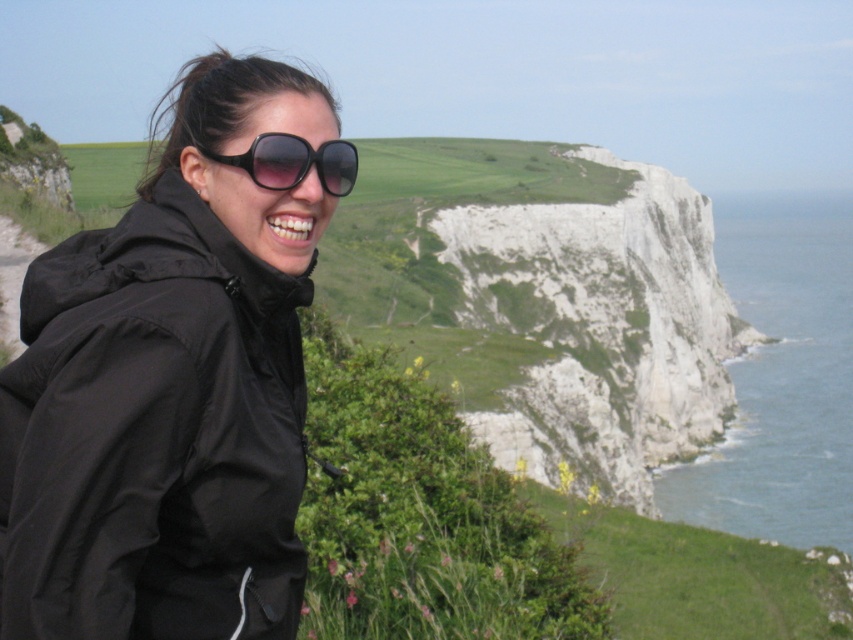
Between black matte jacket at left and black plastic sunglasses at upper center, which one appears on the left side from the viewer's perspective?

Positioned to the left is black matte jacket at left.

Is black matte jacket at left bigger than black plastic sunglasses at upper center?

Yes.

What do you see at coordinates (154, 435) in the screenshot? I see `black matte jacket at left` at bounding box center [154, 435].

You are a GUI agent. You are given a task and a screenshot of the screen. Output one action in this format:
    pyautogui.click(x=<x>, y=<y>)
    Task: Click on the black matte jacket at left
    
    Given the screenshot: What is the action you would take?
    pyautogui.click(x=154, y=435)